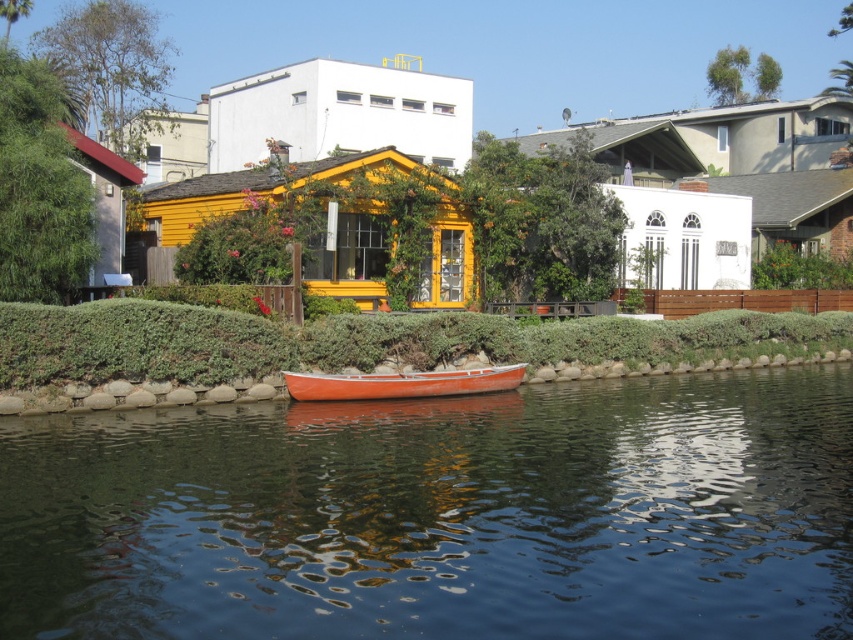
You are standing at the point with coordinates (442, 515) in the waterfront scene. What object would you be standing on?

You are standing on the glossy orange boat at center located at point (442, 515).

You are standing at the edge of the water near the yellow house and want to reach the glossy orange boat at center. According to the coordinates provided, is the boat closer to the house or further away from it?

The glossy orange boat at center is located at point 0.805 on the x and y axis, which means it is closer to the house since it is near the edge of the property.